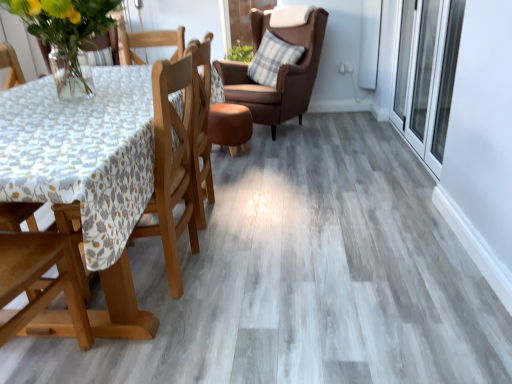
What are the coordinates of `translucent glass vase at upper left` in the screenshot? It's located at (64, 25).

How much space does brown leather chair at upper center, the 1th chair when ordered from top to bottom, occupy horizontally?

It is 36.61 inches.

Locate an element on the screen. The width and height of the screenshot is (512, 384). plaid fabric pillow at upper right is located at coordinates (272, 59).

The height and width of the screenshot is (384, 512). In order to click on transparent glass screen door at right in this screenshot , I will do `click(426, 75)`.

Measure the distance between point (194,49) and camera.

They are 2.06 meters apart.

Find the location of a particular element. The width and height of the screenshot is (512, 384). translucent glass vase at upper left is located at coordinates (64, 25).

Considering the positions of point (161, 216) and point (241, 85), is point (161, 216) closer or farther from the camera than point (241, 85)?

Point (161, 216).

From the picture: Does wooden chair at left, positioned as the first chair in bottom-to-top order, have a greater width compared to brown leather chair at upper center, the 2th chair viewed from the front?

No.

Is wooden chair at left, acting as the first chair starting from the front, positioned far away from brown leather chair at upper center, arranged as the second chair when ordered from the bottom?

Indeed, wooden chair at left, acting as the first chair starting from the front, is not near brown leather chair at upper center, arranged as the second chair when ordered from the bottom.

Considering the sizes of objects wooden chair at left, positioned as the first chair in bottom-to-top order, and brown leather chair at upper center, the 2th chair viewed from the front, in the image provided, who is bigger, wooden chair at left, positioned as the first chair in bottom-to-top order, or brown leather chair at upper center, the 2th chair viewed from the front,?

Bigger between the two is brown leather chair at upper center, the 2th chair viewed from the front.

Can you confirm if plaid fabric pillow at upper right is wider than translucent glass vase at upper left?

In fact, plaid fabric pillow at upper right might be narrower than translucent glass vase at upper left.

Consider the image. Which of these two, plaid fabric pillow at upper right or translucent glass vase at upper left, is smaller?

plaid fabric pillow at upper right is smaller.

Would you say plaid fabric pillow at upper right is a long distance from translucent glass vase at upper left?

Absolutely, plaid fabric pillow at upper right is distant from translucent glass vase at upper left.

Would you say plaid fabric pillow at upper right contains brown leather chair at upper center, the 1th chair when ordered from top to bottom?

Definitely not — brown leather chair at upper center, the 1th chair when ordered from top to bottom, is not inside plaid fabric pillow at upper right.

From a real-world perspective, is plaid fabric pillow at upper right below brown leather chair at upper center, the 2th chair viewed from the front?

Actually, plaid fabric pillow at upper right is physically above brown leather chair at upper center, the 2th chair viewed from the front, in the real world.

Are plaid fabric pillow at upper right and brown leather chair at upper center, the 2th chair viewed from the front, located far from each other?

No.

Does plaid fabric pillow at upper right have a greater height compared to brown leather chair at upper center, the 1th chair when ordered from top to bottom?

In fact, plaid fabric pillow at upper right may be shorter than brown leather chair at upper center, the 1th chair when ordered from top to bottom.

Could plaid fabric pillow at upper right be considered to be inside brown leather chair at upper center, the first chair viewed from the back?

Indeed, plaid fabric pillow at upper right is located within brown leather chair at upper center, the first chair viewed from the back.

Between brown leather chair at upper center, arranged as the second chair when ordered from the bottom, and plaid fabric pillow at upper right, which one has less height?

With less height is plaid fabric pillow at upper right.

Which of these two, brown leather chair at upper center, the first chair viewed from the back, or plaid fabric pillow at upper right, is wider?

brown leather chair at upper center, the first chair viewed from the back, is wider.

Visually, is brown leather chair at upper center, the 1th chair when ordered from top to bottom, positioned to the left or to the right of plaid fabric pillow at upper right?

In the image, brown leather chair at upper center, the 1th chair when ordered from top to bottom, appears on the left side of plaid fabric pillow at upper right.

Is plaid fabric pillow at upper right smaller than transparent glass screen door at right?

Yes.

From the image's perspective, is plaid fabric pillow at upper right located above transparent glass screen door at right?

Indeed, from the image's perspective, plaid fabric pillow at upper right is shown above transparent glass screen door at right.

Between plaid fabric pillow at upper right and transparent glass screen door at right, which one has less height?

Standing shorter between the two is plaid fabric pillow at upper right.

Find the location of a particular element. floral arrangement located above the plaid fabric pillow at upper right (from a real-world perspective) is located at coordinates (64, 25).

Are translucent glass vase at upper left and plaid fabric pillow at upper right located far from each other?

That's right, there is a large distance between translucent glass vase at upper left and plaid fabric pillow at upper right.

In the scene shown: Does translucent glass vase at upper left have a lesser height compared to plaid fabric pillow at upper right?

Correct, translucent glass vase at upper left is not as tall as plaid fabric pillow at upper right.

Considering the positions of point (97, 33) and point (261, 75), is point (97, 33) closer or farther from the camera than point (261, 75)?

Point (97, 33).

Considering the relative positions of translucent glass vase at upper left and brown leather chair at upper center, the first chair viewed from the back, in the image provided, is translucent glass vase at upper left to the left or to the right of brown leather chair at upper center, the first chair viewed from the back,?

In the image, translucent glass vase at upper left appears on the left side of brown leather chair at upper center, the first chair viewed from the back.

Between translucent glass vase at upper left and brown leather chair at upper center, the 1th chair when ordered from top to bottom, which one has larger size?

brown leather chair at upper center, the 1th chair when ordered from top to bottom.

From a real-world perspective, which object stands above the other?

translucent glass vase at upper left is physically above.

Is brown leather chair at upper center, the 2th chair viewed from the front, at the back of translucent glass vase at upper left?

Yes, translucent glass vase at upper left is positioned with its back facing brown leather chair at upper center, the 2th chair viewed from the front.

Identify the location of chair on the right of wooden chair at left, the second chair positioned from the back. (278, 72).

The width and height of the screenshot is (512, 384). I want to click on pillow behind the translucent glass vase at upper left, so click(x=272, y=59).

When comparing their distances from brown leather chair at upper center, the first chair viewed from the back, does wooden chair at left, which is the 2th chair from top to bottom, or translucent glass vase at upper left seem closer?

wooden chair at left, which is the 2th chair from top to bottom, is positioned closer to the anchor brown leather chair at upper center, the first chair viewed from the back.

Based on the photo, estimate the real-world distances between objects in this image. Which object is closer to transparent glass screen door at right, plaid fabric pillow at upper right or brown leather chair at upper center, the 2th chair viewed from the front?

brown leather chair at upper center, the 2th chair viewed from the front.

Considering their positions, is transparent glass screen door at right positioned closer to wooden chair at left, the second chair positioned from the back, than brown leather chair at upper center, the 1th chair when ordered from top to bottom?

brown leather chair at upper center, the 1th chair when ordered from top to bottom, is positioned closer to the anchor wooden chair at left, the second chair positioned from the back.

From the image, which object appears to be farther from wooden chair at left, the second chair positioned from the back, translucent glass vase at upper left or plaid fabric pillow at upper right?

plaid fabric pillow at upper right is further to wooden chair at left, the second chair positioned from the back.

Based on their spatial positions, is transparent glass screen door at right or plaid fabric pillow at upper right further from wooden chair at left, the second chair positioned from the back?

plaid fabric pillow at upper right is further to wooden chair at left, the second chair positioned from the back.

From the image, which object appears to be farther from wooden chair at left, the second chair positioned from the back, brown leather chair at upper center, arranged as the second chair when ordered from the bottom, or plaid fabric pillow at upper right?

plaid fabric pillow at upper right.

When comparing their distances from wooden chair at left, acting as the first chair starting from the front, does translucent glass vase at upper left or brown leather chair at upper center, arranged as the second chair when ordered from the bottom, seem further?

The object further to wooden chair at left, acting as the first chair starting from the front, is brown leather chair at upper center, arranged as the second chair when ordered from the bottom.

From the picture: When comparing their distances from plaid fabric pillow at upper right, does translucent glass vase at upper left or transparent glass screen door at right seem closer?

Based on the image, transparent glass screen door at right appears to be nearer to plaid fabric pillow at upper right.

At what (x,y) coordinates should I click in order to perform the action: click on floral arrangement between wooden chair at left, acting as the first chair starting from the front, and brown leather chair at upper center, the 2th chair viewed from the front, from front to back. Please return your answer as a coordinate pair (x, y). The width and height of the screenshot is (512, 384). Looking at the image, I should click on (64, 25).

Where is `screen door positioned between translucent glass vase at upper left and plaid fabric pillow at upper right from near to far`? The height and width of the screenshot is (384, 512). screen door positioned between translucent glass vase at upper left and plaid fabric pillow at upper right from near to far is located at coordinates (426, 75).

The height and width of the screenshot is (384, 512). In order to click on chair positioned between transparent glass screen door at right and plaid fabric pillow at upper right from near to far in this screenshot , I will do `click(278, 72)`.

Find the location of a particular element. The height and width of the screenshot is (384, 512). chair between translucent glass vase at upper left and plaid fabric pillow at upper right from front to back is located at coordinates point(278,72).